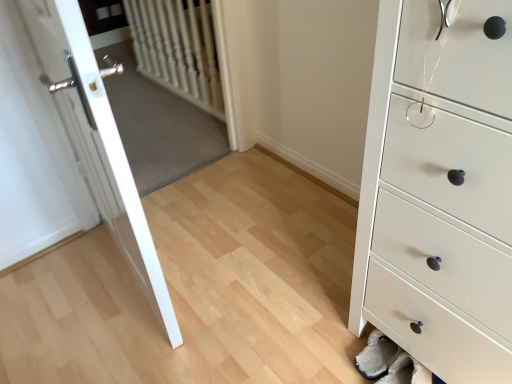
The height and width of the screenshot is (384, 512). I want to click on vacant space positioned to the left of white glossy door at left, so (x=67, y=279).